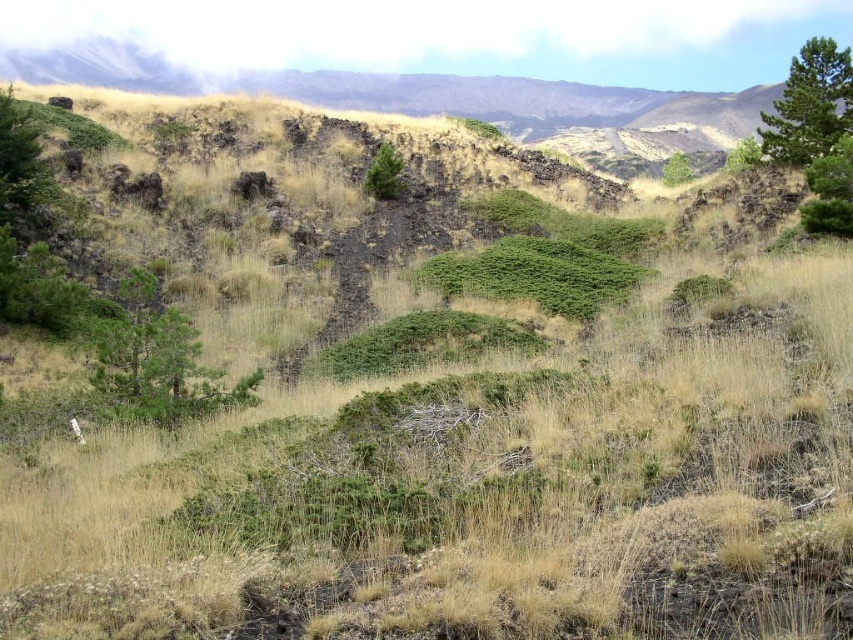
You are a hiker trying to navigate through this rugged landscape. You see the green leafy tree at right and the green textured tree at center. Which tree would block your view of the other if you were standing between them?

The green leafy tree at right is in front of the green textured tree at center, so if you were standing between them, the green leafy tree at right would block your view of the green textured tree at center.